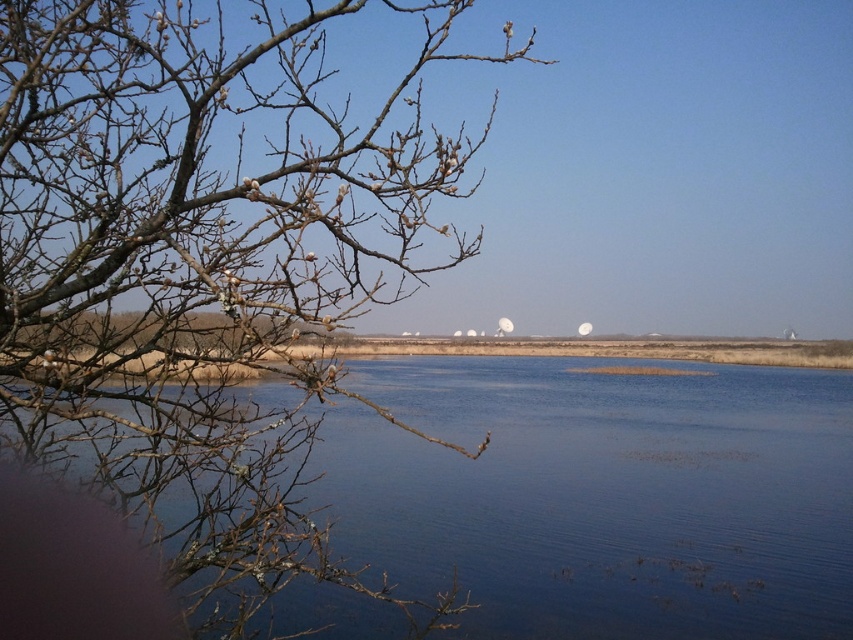
Who is positioned more to the right, bare branches at left or blue water at center?

From the viewer's perspective, blue water at center appears more on the right side.

Between bare branches at left and blue water at center, which one is positioned higher?

blue water at center is higher up.

In the scene shown: Measure the distance between bare branches at left and camera.

bare branches at left and camera are 5.34 meters apart.

Locate an element on the screen. bare branches at left is located at coordinates (199, 260).